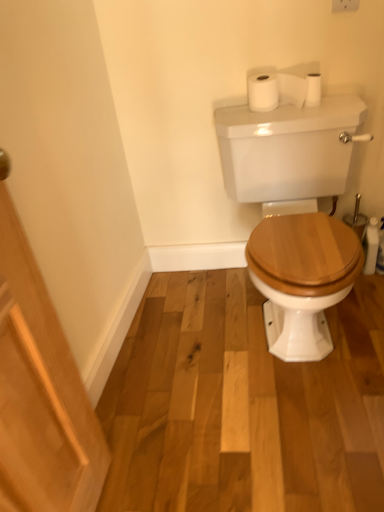
Locate an element on the screen. vacant space to the right of white matte toilet paper at upper center, which is the 1th toilet paper from left to right is located at coordinates (334, 106).